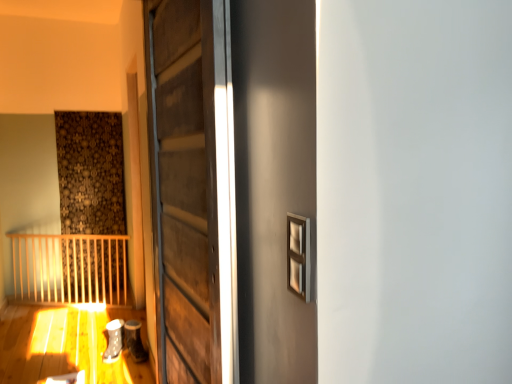
The width and height of the screenshot is (512, 384). What do you see at coordinates (113, 341) in the screenshot?
I see `white matte shoe at lower left, the 2th shoe positioned from the right` at bounding box center [113, 341].

Identify the location of white matte shoe at lower left, acting as the first shoe starting from the left. pos(113,341).

Based on the photo, is wooden door at center positioned with its back to matte gray shoe at lower left, the first shoe from the right?

No, wooden door at center is not facing away from matte gray shoe at lower left, the first shoe from the right.

Considering the points (194, 241) and (126, 323), which point is in front, point (194, 241) or point (126, 323)?

Positioned in front is point (194, 241).

Does wooden door at center have a lesser width compared to matte gray shoe at lower left, the first shoe from the right?

Indeed, wooden door at center has a lesser width compared to matte gray shoe at lower left, the first shoe from the right.

What's the angular difference between white matte shoe at lower left, acting as the first shoe starting from the left, and wooden door at center's facing directions?

70.3 degrees.

Does white matte shoe at lower left, the 2th shoe positioned from the right, contain wooden door at center?

Actually, wooden door at center is outside white matte shoe at lower left, the 2th shoe positioned from the right.

Measure the distance from white matte shoe at lower left, the 2th shoe positioned from the right, to wooden door at center.

white matte shoe at lower left, the 2th shoe positioned from the right, is 5.88 feet away from wooden door at center.

Is white matte shoe at lower left, acting as the first shoe starting from the left, oriented towards wooden door at center?

No, white matte shoe at lower left, acting as the first shoe starting from the left, is not turned towards wooden door at center.

Looking at their sizes, would you say matte gray shoe at lower left, the 2th shoe in the left-to-right sequence, is wider or thinner than white matte shoe at lower left, acting as the first shoe starting from the left?

In the image, matte gray shoe at lower left, the 2th shoe in the left-to-right sequence, appears to be more narrow than white matte shoe at lower left, acting as the first shoe starting from the left.

From the image's perspective, would you say matte gray shoe at lower left, the first shoe from the right, is positioned over white matte shoe at lower left, the 2th shoe positioned from the right?

Yes, from the image's perspective, matte gray shoe at lower left, the first shoe from the right, is on top of white matte shoe at lower left, the 2th shoe positioned from the right.

Which of these two, matte gray shoe at lower left, the 2th shoe in the left-to-right sequence, or white matte shoe at lower left, the 2th shoe positioned from the right, stands shorter?

white matte shoe at lower left, the 2th shoe positioned from the right, is shorter.

Based on the photo, considering the sizes of objects wooden door at center and white matte shoe at lower left, the 2th shoe positioned from the right, in the image provided, who is thinner, wooden door at center or white matte shoe at lower left, the 2th shoe positioned from the right,?

With smaller width is wooden door at center.

Is point (222, 376) closer or farther from the camera than point (115, 327)?

Point (222, 376).

From the image's perspective, starting from the wooden door at center, which shoe is the 2nd one below? Please provide its 2D coordinates.

[(113, 341)]

Is white matte shoe at lower left, the 2th shoe positioned from the right, completely or partially inside wooden door at center?

That's incorrect, white matte shoe at lower left, the 2th shoe positioned from the right, is not inside wooden door at center.

Does white matte shoe at lower left, acting as the first shoe starting from the left, have a greater width compared to matte gray shoe at lower left, the first shoe from the right?

Correct, the width of white matte shoe at lower left, acting as the first shoe starting from the left, exceeds that of matte gray shoe at lower left, the first shoe from the right.

Is the position of white matte shoe at lower left, acting as the first shoe starting from the left, less distant than that of matte gray shoe at lower left, the first shoe from the right?

No, white matte shoe at lower left, acting as the first shoe starting from the left, is behind matte gray shoe at lower left, the first shoe from the right.

Find the location of a particular element. The width and height of the screenshot is (512, 384). shoe in front of the white matte shoe at lower left, acting as the first shoe starting from the left is located at coordinates (134, 341).

Which object is positioned more to the right, matte gray shoe at lower left, the first shoe from the right, or wooden door at center?

wooden door at center is more to the right.

What's the angular difference between matte gray shoe at lower left, the first shoe from the right, and wooden door at center's facing directions?

The facing directions of matte gray shoe at lower left, the first shoe from the right, and wooden door at center are 89 degrees apart.

Is matte gray shoe at lower left, the first shoe from the right, positioned with its back to wooden door at center?

That's not correct — matte gray shoe at lower left, the first shoe from the right, is not looking away from wooden door at center.

From a real-world perspective, is matte gray shoe at lower left, the 2th shoe in the left-to-right sequence, located higher than wooden door at center?

No, from a real-world perspective, matte gray shoe at lower left, the 2th shoe in the left-to-right sequence, is not above wooden door at center.

Identify the location of shoe that is the 1st one when counting backward from the wooden door at center. The height and width of the screenshot is (384, 512). (134, 341).

Image resolution: width=512 pixels, height=384 pixels. What are the coordinates of `door on the right of white matte shoe at lower left, the 2th shoe positioned from the right` in the screenshot? It's located at (191, 188).

Which object lies nearer to the anchor point matte gray shoe at lower left, the 2th shoe in the left-to-right sequence, wooden door at center or white matte shoe at lower left, acting as the first shoe starting from the left?

Among the two, white matte shoe at lower left, acting as the first shoe starting from the left, is located nearer to matte gray shoe at lower left, the 2th shoe in the left-to-right sequence.

Considering their positions, is matte gray shoe at lower left, the first shoe from the right, positioned further to wooden door at center than white matte shoe at lower left, the 2th shoe positioned from the right?

The object further to wooden door at center is matte gray shoe at lower left, the first shoe from the right.

Based on the photo, estimate the real-world distances between objects in this image. Which object is further from white matte shoe at lower left, the 2th shoe positioned from the right, wooden door at center or matte gray shoe at lower left, the first shoe from the right?

Based on the image, wooden door at center appears to be further to white matte shoe at lower left, the 2th shoe positioned from the right.

Which object lies further to the anchor point wooden door at center, white matte shoe at lower left, acting as the first shoe starting from the left, or matte gray shoe at lower left, the first shoe from the right?

matte gray shoe at lower left, the first shoe from the right, is positioned further to the anchor wooden door at center.

Which object lies further to the anchor point matte gray shoe at lower left, the first shoe from the right, white matte shoe at lower left, the 2th shoe positioned from the right, or wooden door at center?

Based on the image, wooden door at center appears to be further to matte gray shoe at lower left, the first shoe from the right.

Which object lies nearer to the anchor point white matte shoe at lower left, acting as the first shoe starting from the left, matte gray shoe at lower left, the 2th shoe in the left-to-right sequence, or wooden door at center?

matte gray shoe at lower left, the 2th shoe in the left-to-right sequence, is closer to white matte shoe at lower left, acting as the first shoe starting from the left.

This screenshot has height=384, width=512. In order to click on shoe between wooden door at center and white matte shoe at lower left, acting as the first shoe starting from the left, along the z-axis in this screenshot , I will do `click(134, 341)`.